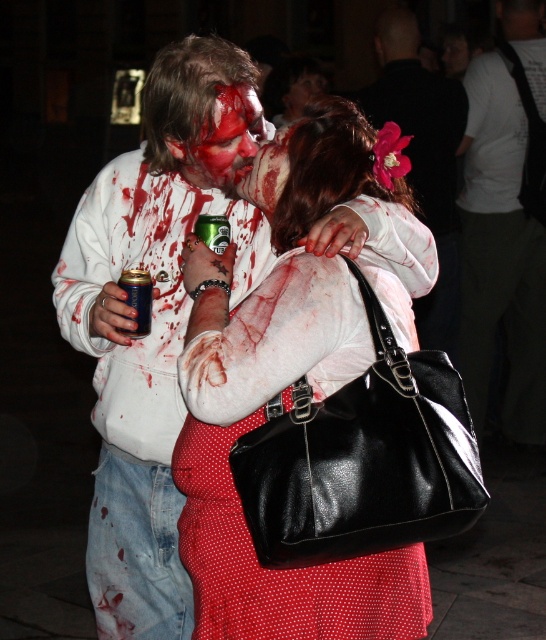
Question: Is white matte shirt at center closer to the viewer compared to blue matte can at center?

Choices:
 (A) yes
 (B) no

Answer: (B)

Question: Which of these objects is positioned closest to the matte white blouse at center?

Choices:
 (A) smooth skin face at center
 (B) bloodied flesh at center
 (C) blood-stained face at center
 (D) blue matte can at center

Answer: (B)

Question: Based on their relative distances, which object is farther from the shiny black hair at upper center?

Choices:
 (A) blood-stained face at center
 (B) smooth skin face at center
 (C) white matte shirt at center

Answer: (A)

Question: Does white matte shirt at center appear over blue matte can at center?

Choices:
 (A) no
 (B) yes

Answer: (B)

Question: Which object is positioned closest to the matte white blouse at center?

Choices:
 (A) blood-stained face at center
 (B) smooth skin face at center
 (C) blue matte can at center

Answer: (A)

Question: Does white matte shirt at center appear on the right side of blue matte can at center?

Choices:
 (A) yes
 (B) no

Answer: (A)